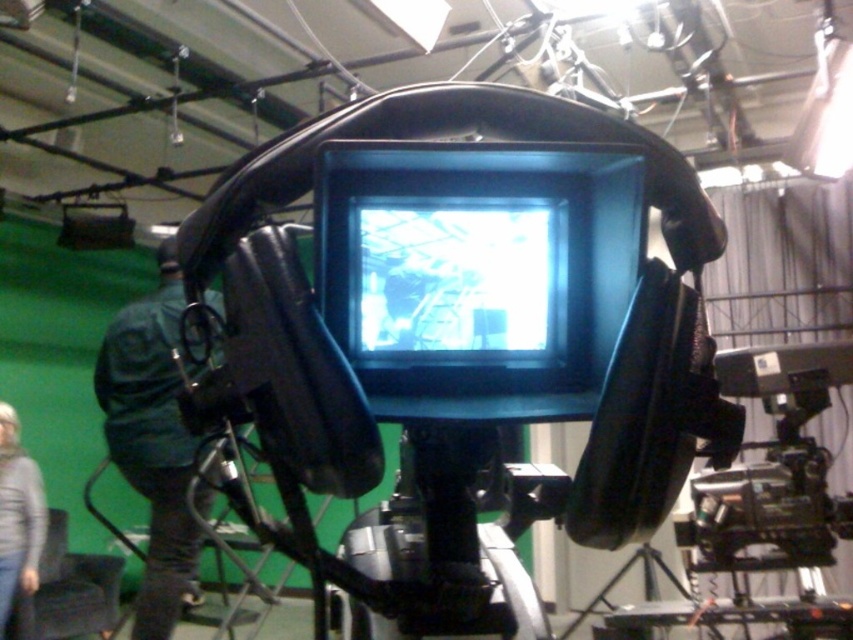
Question: Which object is farther from the camera taking this photo?

Choices:
 (A) denim jacket at lower left
 (B) green fabric at left
 (C) black plastic tripod at lower right
 (D) black plastic video camera at lower right

Answer: (A)

Question: Among these objects, which one is farthest from the camera?

Choices:
 (A) denim jacket at lower left
 (B) black plastic video camera at lower right
 (C) black plastic screen at center
 (D) black plastic tripod at lower right

Answer: (A)

Question: Does black plastic video camera at lower right lie in front of green fabric at left?

Choices:
 (A) no
 (B) yes

Answer: (A)

Question: Is black plastic screen at center bigger than green fabric at left?

Choices:
 (A) no
 (B) yes

Answer: (A)

Question: Which point is farther from the camera taking this photo?

Choices:
 (A) (583, 618)
 (B) (785, 368)
 (C) (167, 532)
 (D) (498, 307)

Answer: (A)

Question: Considering the relative positions of black plastic video camera at lower right and green fabric at left in the image provided, where is black plastic video camera at lower right located with respect to green fabric at left?

Choices:
 (A) below
 (B) above

Answer: (A)